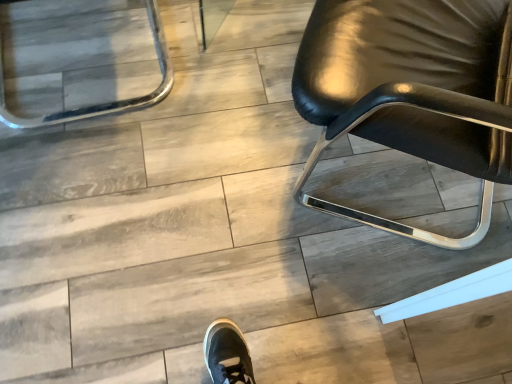
Find the location of a particular element. The image size is (512, 384). free region under clear glass tray at upper left, which is the first chair from left to right (from a real-world perspective) is located at coordinates (83, 62).